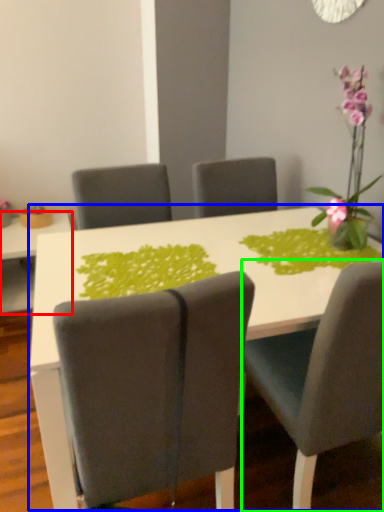
Question: Which is farther away from table (highlighted by a red box)? table (highlighted by a blue box) or chair (highlighted by a green box)?

Choices:
 (A) table
 (B) chair

Answer: (B)